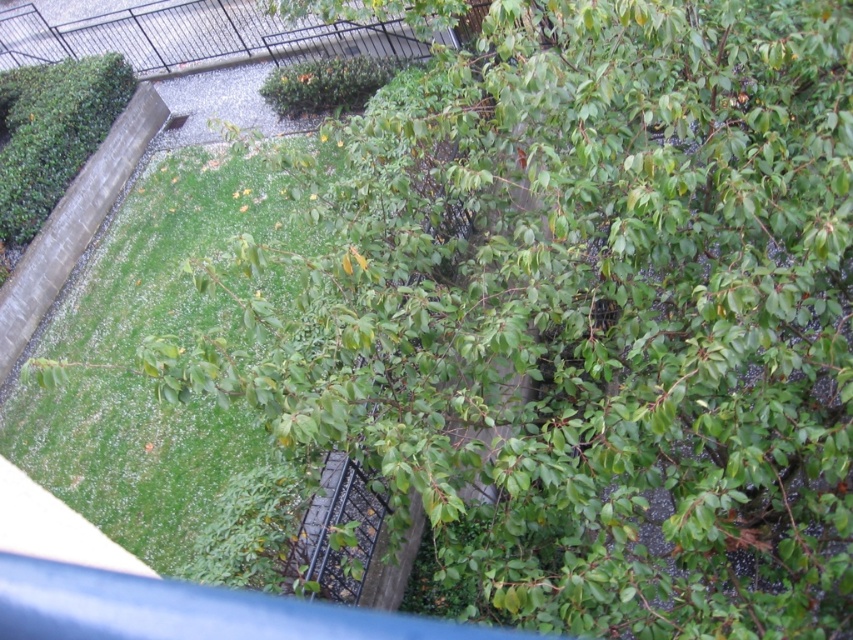
Question: Does green leafy bush at upper left have a greater width compared to green leafy bush at center?

Choices:
 (A) yes
 (B) no

Answer: (A)

Question: Which point is farther to the camera?

Choices:
 (A) (80, 150)
 (B) (321, 76)

Answer: (A)

Question: Which point appears closest to the camera in this image?

Choices:
 (A) (376, 72)
 (B) (107, 80)

Answer: (A)

Question: Can you confirm if green leafy bush at upper left is thinner than green leafy bush at center?

Choices:
 (A) yes
 (B) no

Answer: (B)

Question: Is green leafy bush at upper left to the left of green leafy bush at center from the viewer's perspective?

Choices:
 (A) no
 (B) yes

Answer: (B)

Question: Among these objects, which one is nearest to the camera?

Choices:
 (A) green leafy bush at center
 (B) green leafy bush at upper left

Answer: (B)